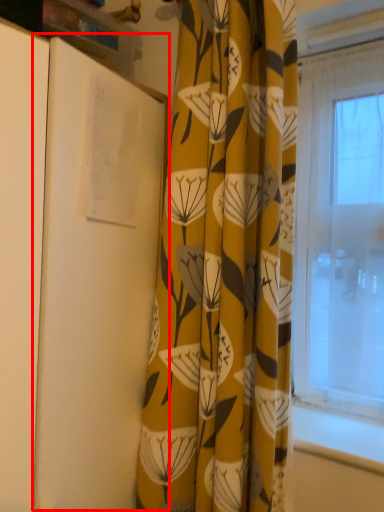
Question: Considering the relative positions of notebook (annotated by the red box) and curtain in the image provided, where is notebook (annotated by the red box) located with respect to the staircase?

Choices:
 (A) left
 (B) right

Answer: (A)